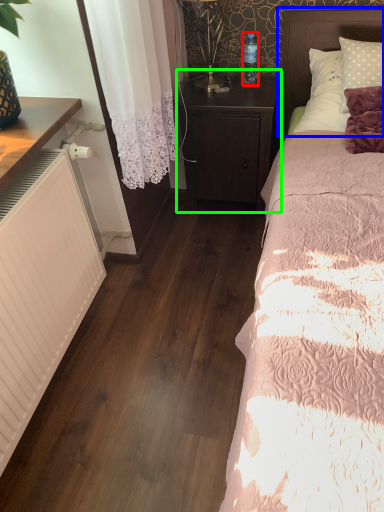
Question: Estimate the real-world distances between objects in this image. Which object is farther from bottle (highlighted by a red box), headboard (highlighted by a blue box) or nightstand (highlighted by a green box)?

Choices:
 (A) headboard
 (B) nightstand

Answer: (B)